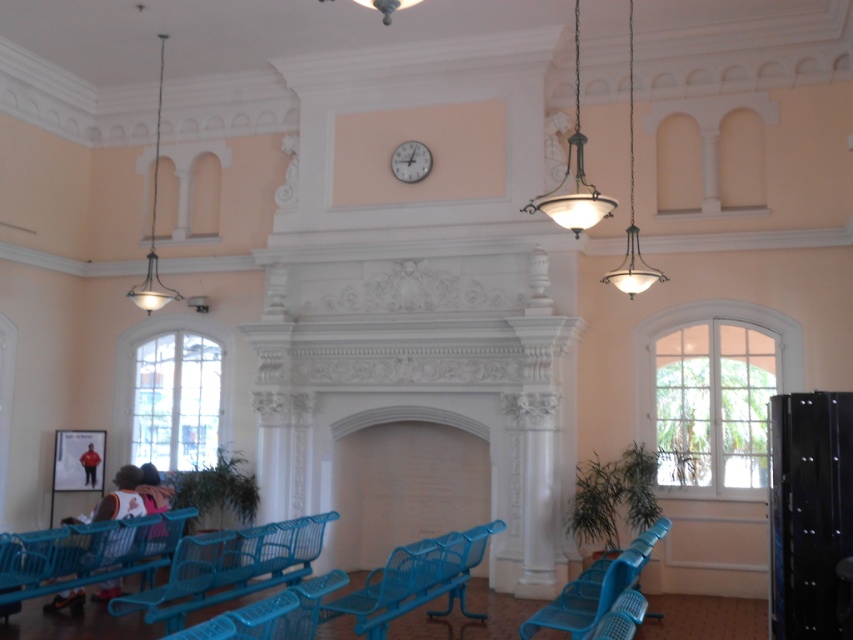
Question: Which object is farther from the camera taking this photo?

Choices:
 (A) green glass pendant light at upper center
 (B) matte blue bench at lower left
 (C) white matte clock at upper center

Answer: (C)

Question: Is green glass pendant light at upper center below metallic/textured pendant light at upper right?

Choices:
 (A) no
 (B) yes

Answer: (A)

Question: Which object appears farthest from the camera in this image?

Choices:
 (A) metallic blue bench at center
 (B) white matte clock at upper center
 (C) metallic pendant light at upper left
 (D) blue plastic chair at lower right

Answer: (C)

Question: Does blue plastic bench at lower left have a lesser width compared to blue plastic chair at lower right?

Choices:
 (A) yes
 (B) no

Answer: (B)

Question: Can you confirm if blue plastic bench at lower left is positioned above white matte clock at upper center?

Choices:
 (A) no
 (B) yes

Answer: (A)

Question: Based on their relative distances, which object is nearer to the blue plastic bench at lower left?

Choices:
 (A) blue plastic chair at lower right
 (B) metallic blue bench at center
 (C) metallic pendant light at upper left
 (D) green glass pendant light at upper center

Answer: (B)